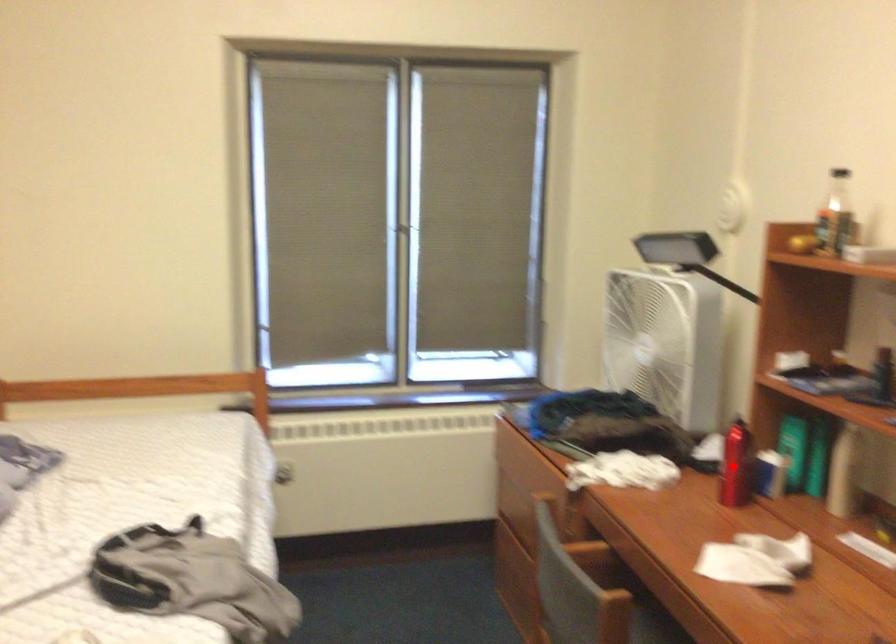
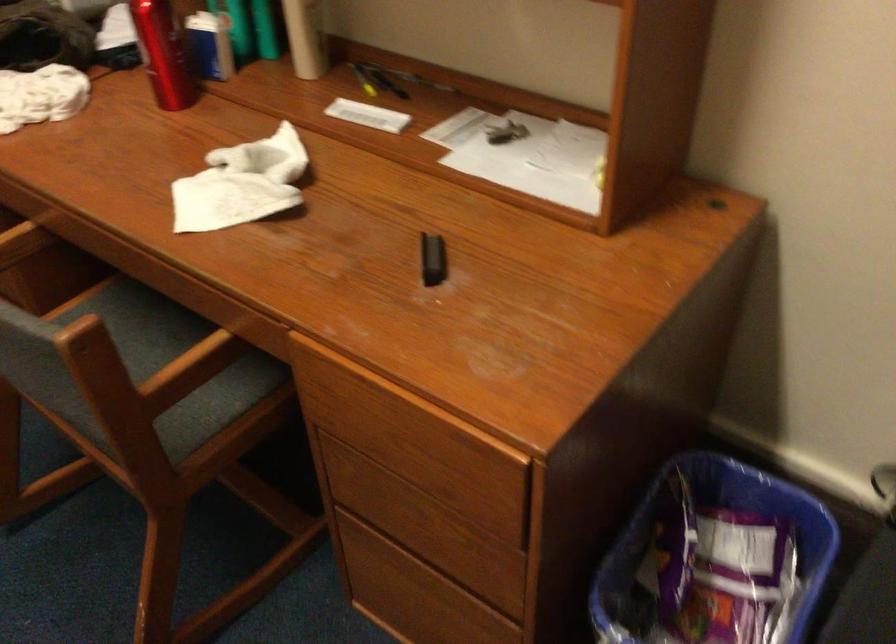
Question: I am providing you with two images of the same scene from different viewpoints. In image1, a red point is highlighted. Considering the same 3D point in image2, which of the following is correct?

Choices:
 (A) It is closer
 (B) It is farther

Answer: (A)